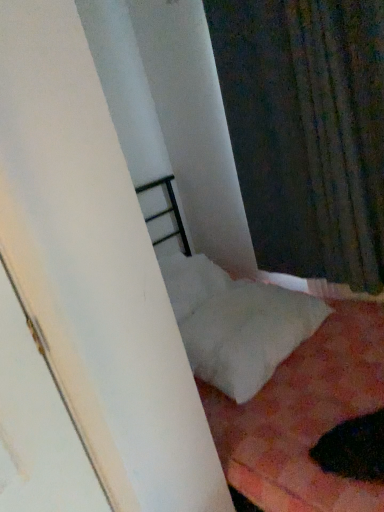
Question: Is white soft pillow at lower right located outside white soft bed at lower right?

Choices:
 (A) yes
 (B) no

Answer: (B)

Question: Can you confirm if white soft pillow at lower right is shorter than white soft bed at lower right?

Choices:
 (A) no
 (B) yes

Answer: (B)

Question: Considering the relative positions of white soft pillow at lower right and white soft bed at lower right in the image provided, is white soft pillow at lower right to the right of white soft bed at lower right from the viewer's perspective?

Choices:
 (A) yes
 (B) no

Answer: (A)

Question: Does white soft pillow at lower right have a lesser width compared to white soft bed at lower right?

Choices:
 (A) yes
 (B) no

Answer: (A)

Question: Can you confirm if white soft pillow at lower right is taller than white soft bed at lower right?

Choices:
 (A) yes
 (B) no

Answer: (B)

Question: Would you say white soft bed at lower right is inside or outside dark textured fabric at upper right?

Choices:
 (A) outside
 (B) inside

Answer: (A)

Question: In terms of width, does white soft bed at lower right look wider or thinner when compared to dark textured fabric at upper right?

Choices:
 (A) wide
 (B) thin

Answer: (A)

Question: Considering the relative positions of white soft bed at lower right and dark textured fabric at upper right in the image provided, is white soft bed at lower right to the left or to the right of dark textured fabric at upper right?

Choices:
 (A) left
 (B) right

Answer: (A)

Question: Based on their sizes in the image, would you say white soft bed at lower right is bigger or smaller than dark textured fabric at upper right?

Choices:
 (A) big
 (B) small

Answer: (A)

Question: From their relative heights in the image, would you say dark textured fabric at upper right is taller or shorter than white soft pillow at lower right?

Choices:
 (A) tall
 (B) short

Answer: (A)

Question: From the image's perspective, is dark textured fabric at upper right positioned above or below white soft pillow at lower right?

Choices:
 (A) above
 (B) below

Answer: (A)

Question: Looking at the image, does dark textured fabric at upper right seem bigger or smaller compared to white soft pillow at lower right?

Choices:
 (A) small
 (B) big

Answer: (B)

Question: Is dark textured fabric at upper right spatially inside white soft pillow at lower right, or outside of it?

Choices:
 (A) inside
 (B) outside

Answer: (B)

Question: Considering the positions of white soft pillow at lower right and dark textured fabric at upper right in the image, is white soft pillow at lower right wider or thinner than dark textured fabric at upper right?

Choices:
 (A) wide
 (B) thin

Answer: (A)

Question: Does point (218, 348) appear closer or farther from the camera than point (309, 225)?

Choices:
 (A) closer
 (B) farther

Answer: (A)